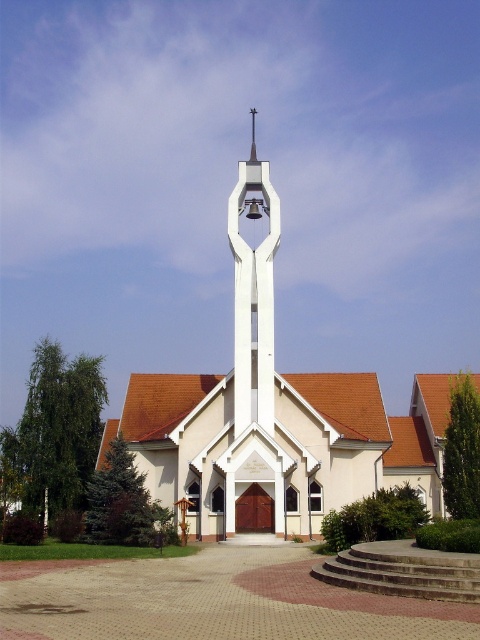
Is point (193, 426) closer to viewer compared to point (241, 328)?

That is True.

Between white smooth church steeple at center and white smooth bell at center, which one has more height?

With more height is white smooth church steeple at center.

This screenshot has width=480, height=640. What do you see at coordinates (274, 416) in the screenshot?
I see `white smooth church steeple at center` at bounding box center [274, 416].

At what (x,y) coordinates should I click in order to perform the action: click on white smooth church steeple at center. Please return your answer as a coordinate pair (x, y). Looking at the image, I should click on (274, 416).